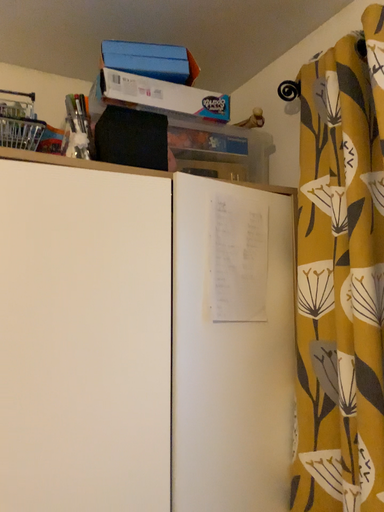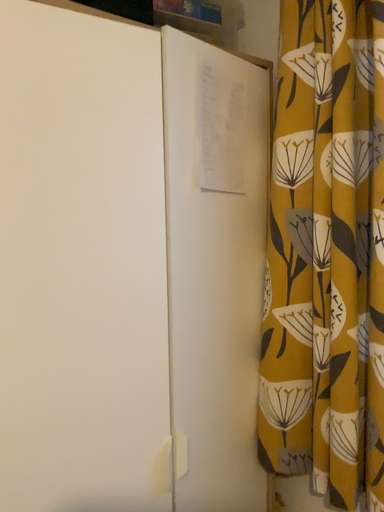
Question: Which way did the camera rotate in the video?

Choices:
 (A) rotated downward
 (B) rotated upward

Answer: (A)